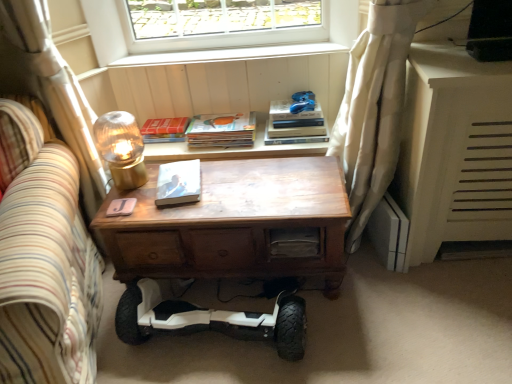
Question: In terms of height, does blue fabric toy at upper center look taller or shorter compared to hardcover book at upper center, placed as the 1th paperback book when sorted from top to bottom?

Choices:
 (A) tall
 (B) short

Answer: (B)

Question: Relative to hardcover book at upper center, which ranks as the 3th paperback book in front-to-back order, is blue fabric toy at upper center in front or behind?

Choices:
 (A) behind
 (B) front

Answer: (B)

Question: Which object is positioned farthest from the wooden drawer at center?

Choices:
 (A) white matte segway at lower center
 (B) hardcover book at upper center, which ranks as the 3th paperback book in bottom-to-top order
 (C) white fabric curtain at right, positioned as the first curtain in right-to-left order
 (D) white wood window sill at upper center
 (E) matte white book at center, placed as the first paperback book when sorted from front to back

Answer: (D)

Question: Considering the real-world distances, which object is closest to the translucent glass lampshade at upper left?

Choices:
 (A) wooden desk at center
 (B) matte white book at center, placed as the first paperback book when sorted from front to back
 (C) white sheer curtain at left, which is counted as the 1th curtain, starting from the left
 (D) white fabric curtain at right, which is counted as the second curtain, starting from the left
 (E) white wood window sill at upper center

Answer: (B)